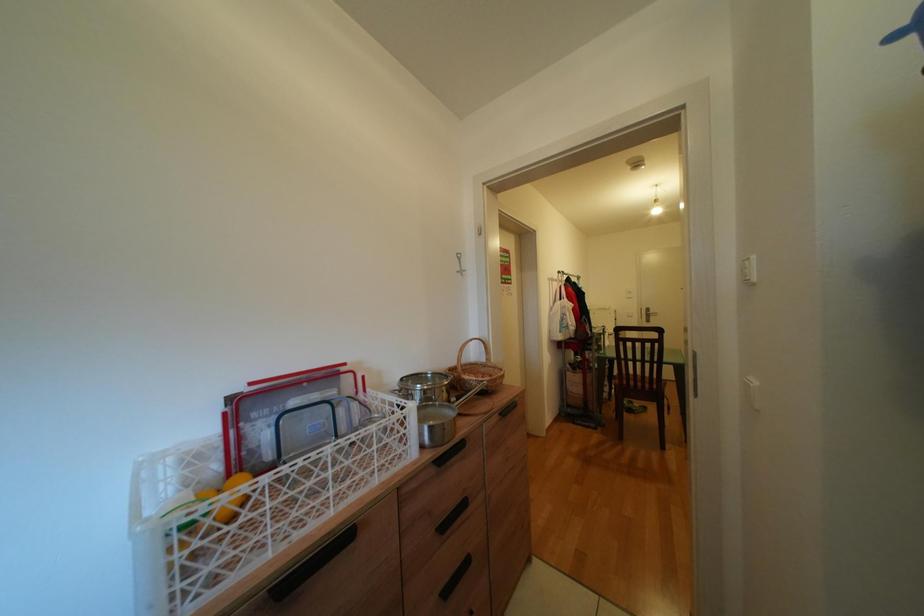
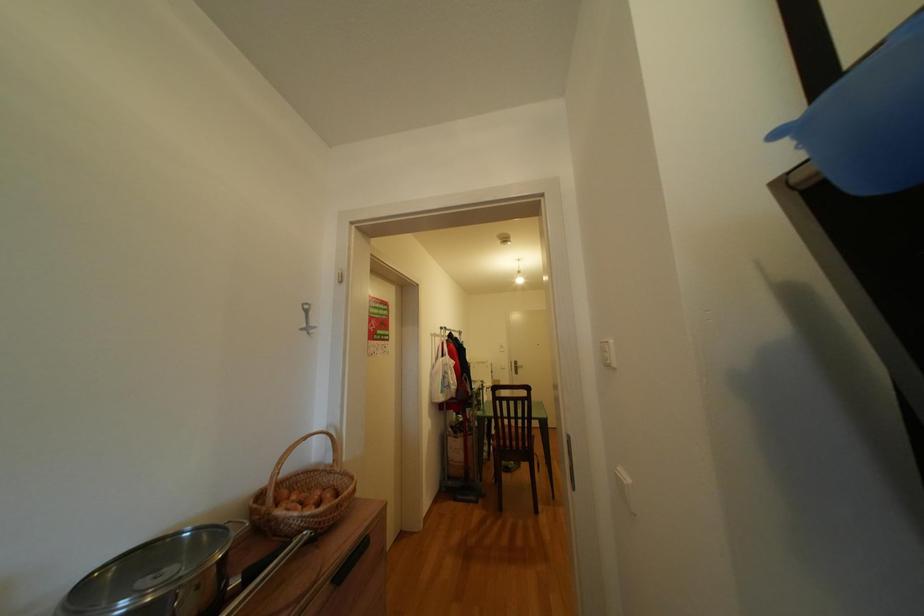
Question: The camera is either moving clockwise (left) or counter-clockwise (right) around the object. The first image is from the beginning of the video and the second image is from the end. Is the camera moving left or right when shooting the video?

Choices:
 (A) Left
 (B) Right

Answer: (A)